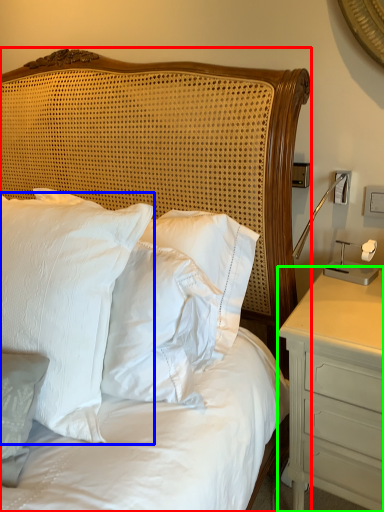
Question: Which is nearer to the bed (highlighted by a red box)? pillow (highlighted by a blue box) or nightstand (highlighted by a green box).

Choices:
 (A) pillow
 (B) nightstand

Answer: (A)